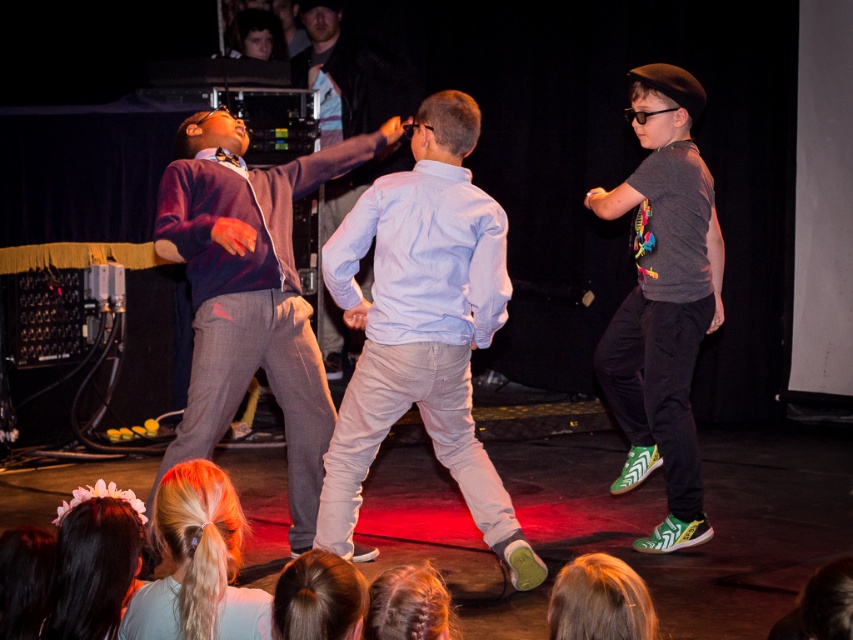
Which is more to the right, light blue cotton shirt at center or blonde hair at lower center?

From the viewer's perspective, blonde hair at lower center appears more on the right side.

Who is more forward, (345, 492) or (550, 616)?

Positioned in front is point (550, 616).

Identify the location of light blue cotton shirt at center. The height and width of the screenshot is (640, 853). (422, 326).

Image resolution: width=853 pixels, height=640 pixels. Identify the location of light blue cotton shirt at center. (422, 326).

Does light blue cotton shirt at center appear on the right side of smooth brown hair at lower center?

Yes, light blue cotton shirt at center is to the right of smooth brown hair at lower center.

Between light blue cotton shirt at center and smooth brown hair at lower center, which one is positioned lower?

smooth brown hair at lower center is below.

Who is more distant from viewer, (496, 259) or (351, 570)?

The point (496, 259) is more distant.

This screenshot has width=853, height=640. In order to click on light blue cotton shirt at center in this screenshot , I will do `click(422, 326)`.

Can you confirm if blonde hair at lower left is bigger than light blue shirt at center?

Incorrect, blonde hair at lower left is not larger than light blue shirt at center.

Where is `blonde hair at lower left`? blonde hair at lower left is located at coordinates (196, 563).

Which is behind, point (225, 566) or point (318, 204)?

Point (318, 204)

This screenshot has height=640, width=853. I want to click on blonde hair at lower left, so click(196, 563).